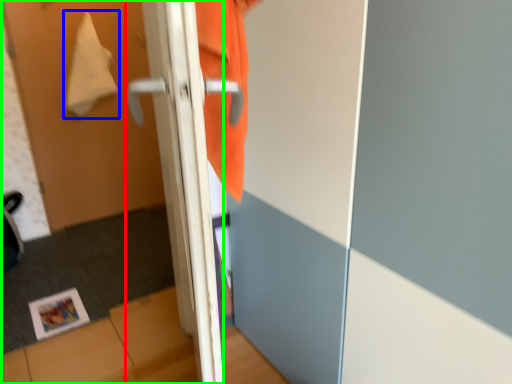
Question: Which is farther away from door (highlighted by a red box)? blanket (highlighted by a blue box) or screen door (highlighted by a green box)?

Choices:
 (A) blanket
 (B) screen door

Answer: (A)